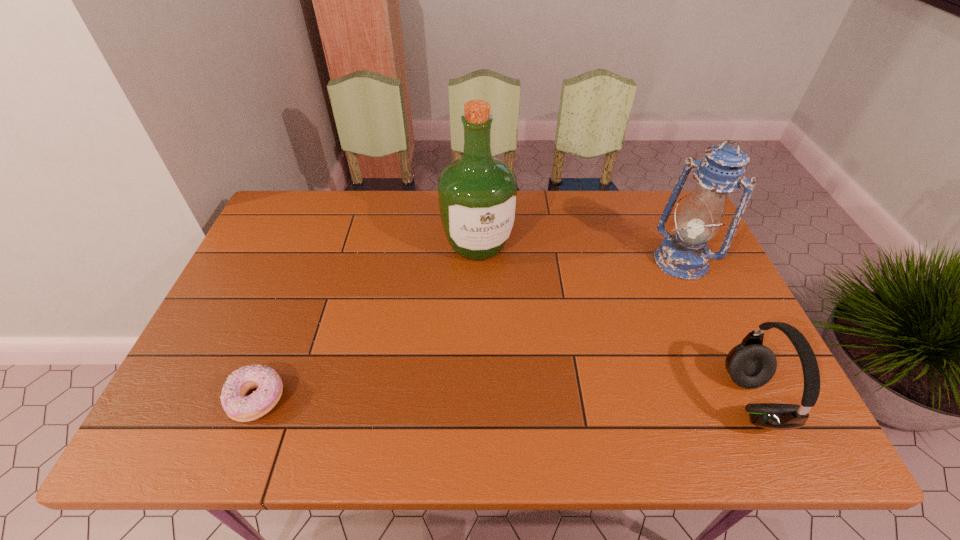
The height and width of the screenshot is (540, 960). I want to click on vacant area situated 0.100m on the front-facing side of the liquor, so click(x=497, y=294).

The image size is (960, 540). What are the coordinates of `free space located 0.150m on the front-facing side of the liquor` in the screenshot? It's located at (503, 308).

Locate an element on the screen. This screenshot has width=960, height=540. free point located on the front-facing side of the lantern is located at coordinates (660, 287).

Locate an element on the screen. The width and height of the screenshot is (960, 540). free spot located on the front-facing side of the lantern is located at coordinates (618, 338).

The height and width of the screenshot is (540, 960). Find the location of `vacant space located 0.190m on the front-facing side of the lantern`. vacant space located 0.190m on the front-facing side of the lantern is located at coordinates (637, 314).

In order to click on object positioned at the far edge in this screenshot , I will do `click(478, 193)`.

Where is `doughnut that is positioned at the near edge`? doughnut that is positioned at the near edge is located at coordinates (239, 407).

Identify the location of headset at the near edge. (750, 364).

Where is `object that is at the left edge`? object that is at the left edge is located at coordinates (239, 407).

Identify the location of headset located in the right edge section of the desktop. (750, 364).